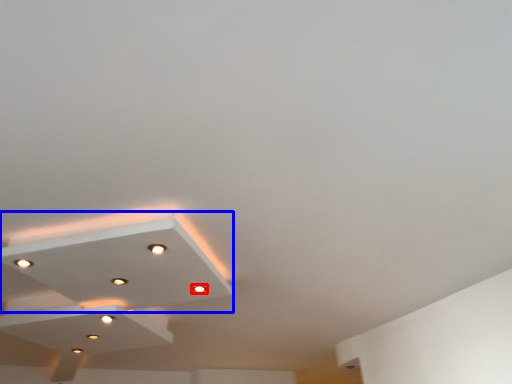
Question: Which point is further to the camera, light (highlighted by a red box) or lamp (highlighted by a blue box)?

Choices:
 (A) light
 (B) lamp

Answer: (A)